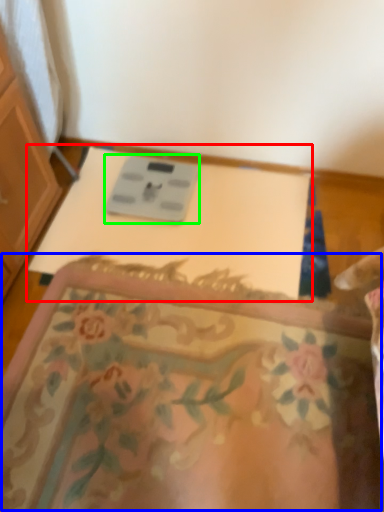
Question: Based on their relative distances, which object is farther from changing table (highlighted by a red box)? Choose from mat (highlighted by a blue box) and scale (highlighted by a green box).

Choices:
 (A) mat
 (B) scale

Answer: (A)